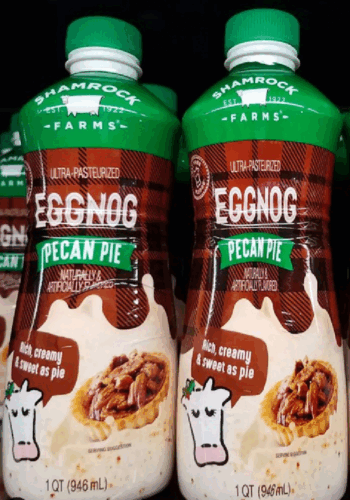
Where is `middle bottle`? The height and width of the screenshot is (500, 350). middle bottle is located at coordinates (56, 178).